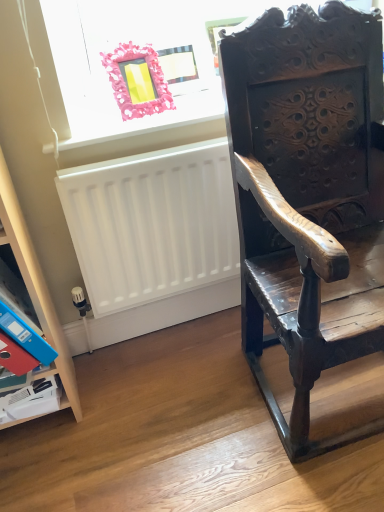
What is the approximate height of red paper at lower left?

The height of red paper at lower left is 2.51 inches.

Describe the element at coordinates (137, 81) in the screenshot. I see `pink fabric picture frame at upper left` at that location.

At what (x,y) coordinates should I click in order to perform the action: click on pink plastic frame at upper left. Please return your answer as a coordinate pair (x, y). Looking at the image, I should click on (151, 129).

I want to click on wooden shelf at lower left, so click(x=37, y=287).

This screenshot has height=512, width=384. What do you see at coordinates (152, 224) in the screenshot?
I see `white matte radiator at lower left` at bounding box center [152, 224].

At what (x,y) coordinates should I click in order to perform the action: click on red paper at lower left. Please return your answer as a coordinate pair (x, y). Image resolution: width=384 pixels, height=512 pixels. Looking at the image, I should click on (25, 336).

This screenshot has width=384, height=512. Identify the location of picture frame above the wooden shelf at lower left (from the image's perspective). (137, 81).

Is pink fabric picture frame at upper left in contact with wooden shelf at lower left?

No, pink fabric picture frame at upper left is not in contact with wooden shelf at lower left.

Considering the sizes of objects pink fabric picture frame at upper left and wooden shelf at lower left in the image provided, who is taller, pink fabric picture frame at upper left or wooden shelf at lower left?

wooden shelf at lower left.

From the image's perspective, between pink fabric picture frame at upper left and wooden shelf at lower left, who is located below?

wooden shelf at lower left is shown below in the image.

Can you confirm if red paper at lower left is shorter than wooden shelf at lower left?

Yes, red paper at lower left is shorter than wooden shelf at lower left.

From a real-world perspective, is red paper at lower left over wooden shelf at lower left?

No, from a real-world perspective, red paper at lower left is not on top of wooden shelf at lower left.

Would you say red paper at lower left is inside or outside wooden shelf at lower left?

red paper at lower left is enclosed within wooden shelf at lower left.

How far apart are red paper at lower left and wooden shelf at lower left?

A distance of 16.02 centimeters exists between red paper at lower left and wooden shelf at lower left.

Could you tell me if dark wood carved chair at right is turned towards red paper at lower left?

No.

Is dark wood carved chair at right in contact with red paper at lower left?

dark wood carved chair at right and red paper at lower left are clearly separated.

At what (x,y) coordinates should I click in order to perform the action: click on paperback book that appears below the dark wood carved chair at right (from the image's perspective). Please return your answer as a coordinate pair (x, y). Looking at the image, I should click on (25, 336).

Can you confirm if dark wood carved chair at right is bigger than red paper at lower left?

Yes, dark wood carved chair at right is bigger than red paper at lower left.

Between pink plastic frame at upper left and red paper at lower left, which one appears on the left side from the viewer's perspective?

red paper at lower left.

From a real-world perspective, who is located higher, pink plastic frame at upper left or red paper at lower left?

From a 3D spatial view, pink plastic frame at upper left is above.

Which object is further away from the camera, pink plastic frame at upper left or red paper at lower left?

pink plastic frame at upper left is further from the camera.

I want to click on window sill that is behind the wooden shelf at lower left, so click(151, 129).

Between pink plastic frame at upper left and wooden shelf at lower left, which one has smaller size?

pink plastic frame at upper left.

Is pink plastic frame at upper left not close to wooden shelf at lower left?

No.

Which of these two, pink plastic frame at upper left or wooden shelf at lower left, is thinner?

With smaller width is wooden shelf at lower left.

Is white matte radiator at lower left aimed at pink fabric picture frame at upper left?

No, white matte radiator at lower left is not aimed at pink fabric picture frame at upper left.

Considering the sizes of objects white matte radiator at lower left and pink fabric picture frame at upper left in the image provided, who is smaller, white matte radiator at lower left or pink fabric picture frame at upper left?

With smaller size is pink fabric picture frame at upper left.

Considering the relative positions of white matte radiator at lower left and pink fabric picture frame at upper left in the image provided, is white matte radiator at lower left to the right of pink fabric picture frame at upper left from the viewer's perspective?

Correct, you'll find white matte radiator at lower left to the right of pink fabric picture frame at upper left.

Considering the sizes of objects red paper at lower left and white matte radiator at lower left in the image provided, who is thinner, red paper at lower left or white matte radiator at lower left?

white matte radiator at lower left.

From a real-world perspective, is red paper at lower left below white matte radiator at lower left?

Yes.

Can you confirm if red paper at lower left is bigger than white matte radiator at lower left?

No, red paper at lower left is not bigger than white matte radiator at lower left.

Locate an element on the screen. The image size is (384, 512). picture frame above the wooden shelf at lower left (from a real-world perspective) is located at coordinates (137, 81).

Where is `paperback book lying below the wooden shelf at lower left (from the image's perspective)`? Image resolution: width=384 pixels, height=512 pixels. paperback book lying below the wooden shelf at lower left (from the image's perspective) is located at coordinates [x=25, y=336].

When comparing their distances from pink fabric picture frame at upper left, does wooden shelf at lower left or pink plastic frame at upper left seem closer?

pink plastic frame at upper left.

Which object lies further to the anchor point pink plastic frame at upper left, pink fabric picture frame at upper left or wooden shelf at lower left?

The object further to pink plastic frame at upper left is wooden shelf at lower left.

In the scene shown: Estimate the real-world distances between objects in this image. Which object is closer to white matte radiator at lower left, dark wood carved chair at right or wooden shelf at lower left?

dark wood carved chair at right is closer to white matte radiator at lower left.

Which object lies further to the anchor point white matte radiator at lower left, dark wood carved chair at right or pink fabric picture frame at upper left?

Based on the image, pink fabric picture frame at upper left appears to be further to white matte radiator at lower left.

From the picture: Based on their spatial positions, is wooden shelf at lower left or pink plastic frame at upper left further from dark wood carved chair at right?

A: Based on the image, wooden shelf at lower left appears to be further to dark wood carved chair at right.

Considering their positions, is dark wood carved chair at right positioned closer to wooden shelf at lower left than red paper at lower left?

Based on the image, red paper at lower left appears to be nearer to wooden shelf at lower left.

From the image, which object appears to be nearer to wooden shelf at lower left, pink fabric picture frame at upper left or pink plastic frame at upper left?

pink plastic frame at upper left is closer to wooden shelf at lower left.

Estimate the real-world distances between objects in this image. Which object is further from white matte radiator at lower left, pink plastic frame at upper left or red paper at lower left?

red paper at lower left.

Where is `radiator between pink plastic frame at upper left and red paper at lower left from top to bottom`? The image size is (384, 512). radiator between pink plastic frame at upper left and red paper at lower left from top to bottom is located at coordinates (152, 224).

Where is `window sill between pink fabric picture frame at upper left and white matte radiator at lower left in the up-down direction`? window sill between pink fabric picture frame at upper left and white matte radiator at lower left in the up-down direction is located at coordinates (151, 129).

You are a GUI agent. You are given a task and a screenshot of the screen. Output one action in this format:
    pyautogui.click(x=<x>, y=<y>)
    Task: Click on the radiator that lies between pink fabric picture frame at upper left and wooden shelf at lower left from top to bottom
    The height and width of the screenshot is (512, 384).
    Given the screenshot: What is the action you would take?
    pyautogui.click(x=152, y=224)

Image resolution: width=384 pixels, height=512 pixels. I want to click on window sill between pink fabric picture frame at upper left and wooden shelf at lower left vertically, so click(x=151, y=129).